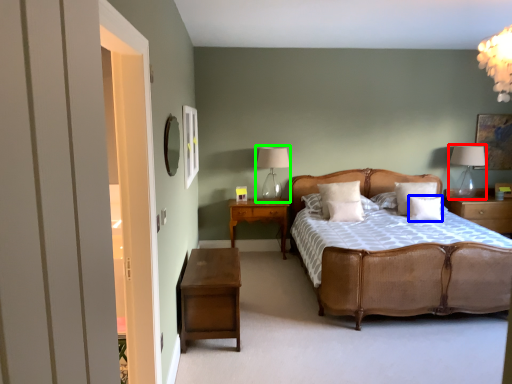
Question: Which object is positioned farthest from table lamp (highlighted by a red box)? Select from pillow (highlighted by a blue box) and table lamp (highlighted by a green box).

Choices:
 (A) pillow
 (B) table lamp

Answer: (B)